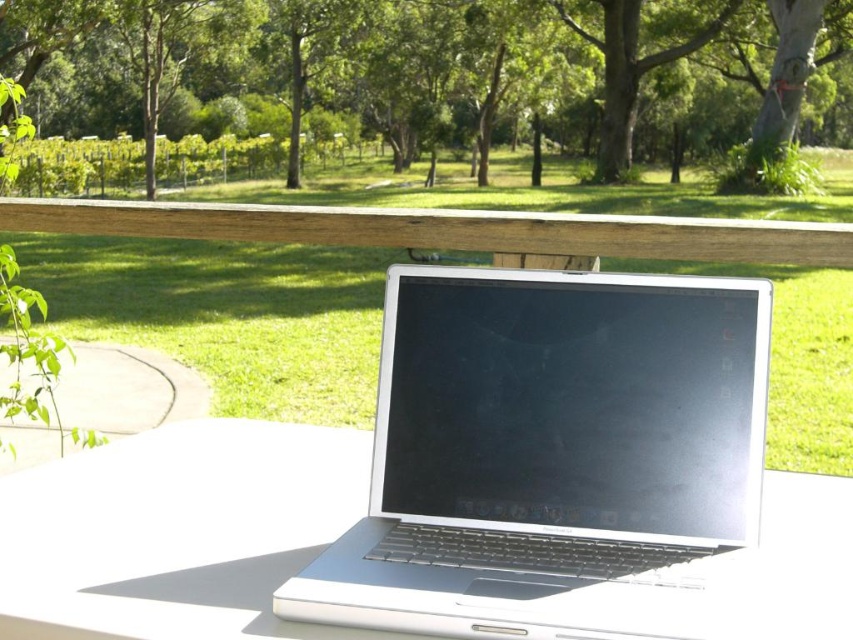
Is sleek silver laptop at center thinner than green leafy tree at upper center?

Indeed, sleek silver laptop at center has a lesser width compared to green leafy tree at upper center.

Who is lower down, sleek silver laptop at center or green leafy tree at upper center?

sleek silver laptop at center

Where is `sleek silver laptop at center`? The width and height of the screenshot is (853, 640). sleek silver laptop at center is located at coordinates (552, 456).

Measure the distance between white glossy table at center and wooden rail at upper center.

white glossy table at center and wooden rail at upper center are 32.62 inches apart from each other.

Is point (241, 506) farther from camera compared to point (616, 218)?

That is False.

At what (x,y) coordinates should I click in order to perform the action: click on white glossy table at center. Please return your answer as a coordinate pair (x, y). The height and width of the screenshot is (640, 853). Looking at the image, I should click on (177, 531).

Is green leafy tree at upper center to the left of white glossy table at center from the viewer's perspective?

In fact, green leafy tree at upper center is to the right of white glossy table at center.

Does green leafy tree at upper center appear under white glossy table at center?

No.

Identify the location of green leafy tree at upper center. This screenshot has height=640, width=853. (x=433, y=76).

Locate an element on the screen. This screenshot has height=640, width=853. green leafy tree at upper center is located at coordinates (433, 76).